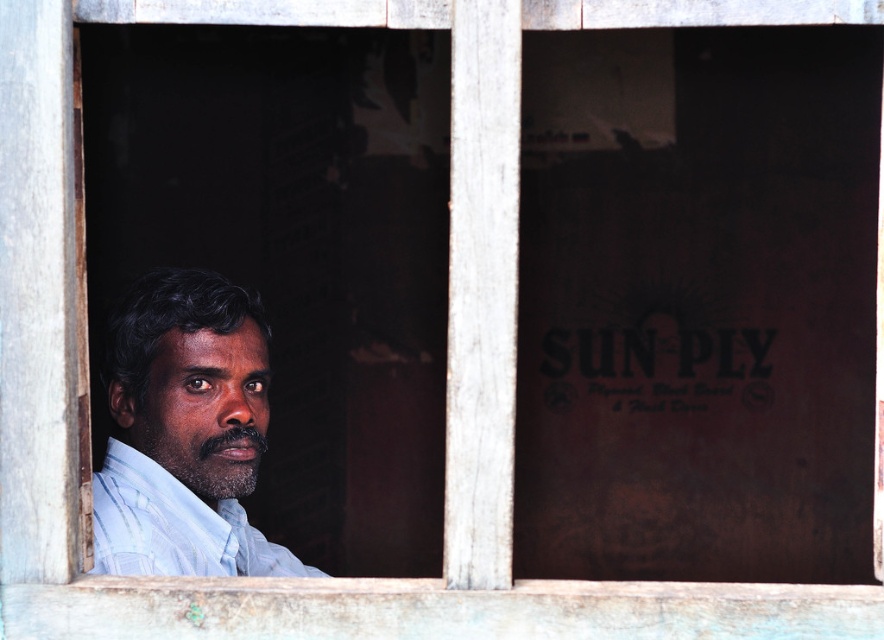
Is point (246, 326) behind point (178, 552)?

Yes, point (246, 326) is behind point (178, 552).

Does light blue shirt at center have a lesser width compared to light blue cotton shirt at left?

Correct, light blue shirt at center's width is less than light blue cotton shirt at left's.

I want to click on light blue shirt at center, so pos(185,433).

The height and width of the screenshot is (640, 884). In order to click on light blue shirt at center in this screenshot , I will do pyautogui.click(x=185, y=433).